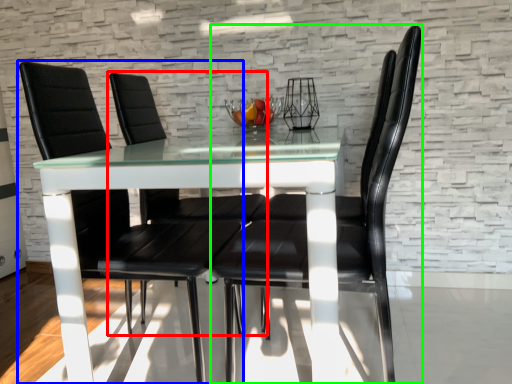
Question: Which object is positioned farthest from chair (highlighted by a red box)? Select from chair (highlighted by a blue box) and chair (highlighted by a green box).

Choices:
 (A) chair
 (B) chair

Answer: (B)